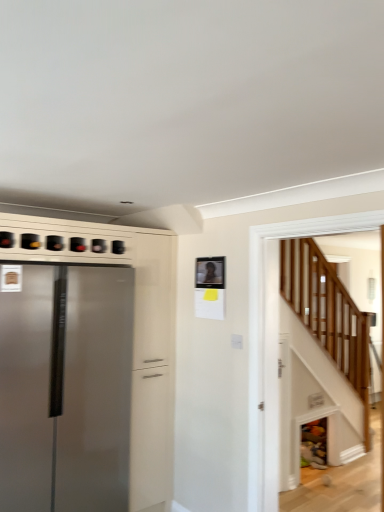
The image size is (384, 512). What do you see at coordinates (328, 314) in the screenshot?
I see `wooden stairs at lower right` at bounding box center [328, 314].

I want to click on wooden stairs at lower right, so click(328, 314).

This screenshot has width=384, height=512. What do you see at coordinates (65, 387) in the screenshot?
I see `satin silver refrigerator at left` at bounding box center [65, 387].

The width and height of the screenshot is (384, 512). What are the coordinates of `satin silver refrigerator at left` in the screenshot? It's located at (65, 387).

What is the approximate width of satin silver refrigerator at left?

satin silver refrigerator at left is 26.34 inches wide.

Locate an element on the screen. This screenshot has width=384, height=512. wooden stairs at lower right is located at coordinates (328, 314).

Which is more to the right, satin silver refrigerator at left or wooden stairs at lower right?

wooden stairs at lower right.

From the picture: Considering the relative positions of satin silver refrigerator at left and wooden stairs at lower right in the image provided, is satin silver refrigerator at left in front of wooden stairs at lower right?

No, satin silver refrigerator at left is further to the viewer.

Which is behind, point (13, 441) or point (368, 426)?

The point (368, 426) is behind.

From the image's perspective, is satin silver refrigerator at left above wooden stairs at lower right?

Actually, satin silver refrigerator at left appears below wooden stairs at lower right in the image.

From a real-world perspective, is satin silver refrigerator at left under wooden stairs at lower right?

Correct, in the physical world, satin silver refrigerator at left is lower than wooden stairs at lower right.

Is satin silver refrigerator at left thinner than wooden stairs at lower right?

In fact, satin silver refrigerator at left might be wider than wooden stairs at lower right.

Who is taller, satin silver refrigerator at left or wooden stairs at lower right?

satin silver refrigerator at left is taller.

Which of these two, satin silver refrigerator at left or wooden stairs at lower right, is smaller?

With smaller size is wooden stairs at lower right.

Based on the photo, is satin silver refrigerator at left not within wooden stairs at lower right?

Yes, satin silver refrigerator at left is outside of wooden stairs at lower right.

Is satin silver refrigerator at left beside wooden stairs at lower right?

No, satin silver refrigerator at left is not next to wooden stairs at lower right.

Is wooden stairs at lower right at the back of satin silver refrigerator at left?

No, wooden stairs at lower right is not at the back of satin silver refrigerator at left.

How different are the orientations of satin silver refrigerator at left and wooden stairs at lower right in degrees?

The angular difference between satin silver refrigerator at left and wooden stairs at lower right is 87.7 degrees.

Locate an element on the screen. This screenshot has height=512, width=384. stairwell on the right of satin silver refrigerator at left is located at coordinates (328, 314).

In the scene shown: Considering the positions of objects wooden stairs at lower right and satin silver refrigerator at left in the image provided, who is more to the left, wooden stairs at lower right or satin silver refrigerator at left?

Positioned to the left is satin silver refrigerator at left.

Which is behind, wooden stairs at lower right or satin silver refrigerator at left?

satin silver refrigerator at left is further away from the camera.

Does point (340, 362) appear closer or farther from the camera than point (1, 357)?

Point (340, 362) is farther from the camera than point (1, 357).

From the image's perspective, between wooden stairs at lower right and satin silver refrigerator at left, which one is located above?

wooden stairs at lower right is shown above in the image.

Consider the image. From a real-world perspective, does wooden stairs at lower right stand above satin silver refrigerator at left?

Yes.

Is wooden stairs at lower right thinner than satin silver refrigerator at left?

Indeed, wooden stairs at lower right has a lesser width compared to satin silver refrigerator at left.

In terms of height, does wooden stairs at lower right look taller or shorter compared to satin silver refrigerator at left?

wooden stairs at lower right is shorter than satin silver refrigerator at left.

Considering the relative sizes of wooden stairs at lower right and satin silver refrigerator at left in the image provided, is wooden stairs at lower right smaller than satin silver refrigerator at left?

Indeed, wooden stairs at lower right has a smaller size compared to satin silver refrigerator at left.

Is satin silver refrigerator at left a part of wooden stairs at lower right?

Definitely not — satin silver refrigerator at left is not inside wooden stairs at lower right.

Can you see wooden stairs at lower right touching satin silver refrigerator at left?

No, wooden stairs at lower right is not beside satin silver refrigerator at left.

From the picture: Could you tell me if wooden stairs at lower right is facing satin silver refrigerator at left?

No, wooden stairs at lower right is not oriented towards satin silver refrigerator at left.

Measure the distance from wooden stairs at lower right to satin silver refrigerator at left.

wooden stairs at lower right and satin silver refrigerator at left are 2.02 meters apart.

Where is `refrigerator that appears on the left of wooden stairs at lower right`? refrigerator that appears on the left of wooden stairs at lower right is located at coordinates (65, 387).

Locate an element on the screen. This screenshot has height=512, width=384. refrigerator beneath the wooden stairs at lower right (from a real-world perspective) is located at coordinates (65, 387).

Where is `stairwell that appears above the satin silver refrigerator at left (from the image's perspective)`? The image size is (384, 512). stairwell that appears above the satin silver refrigerator at left (from the image's perspective) is located at coordinates (328, 314).